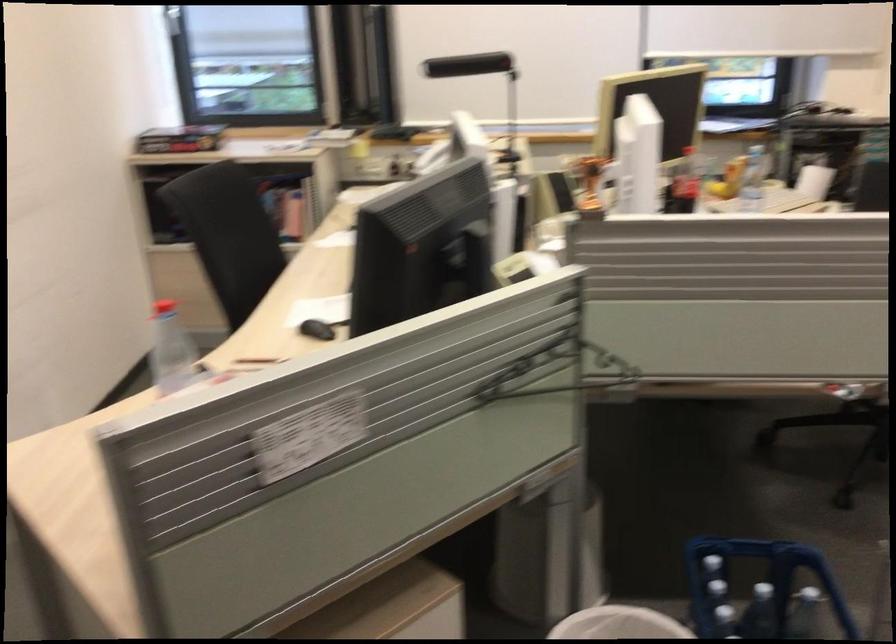
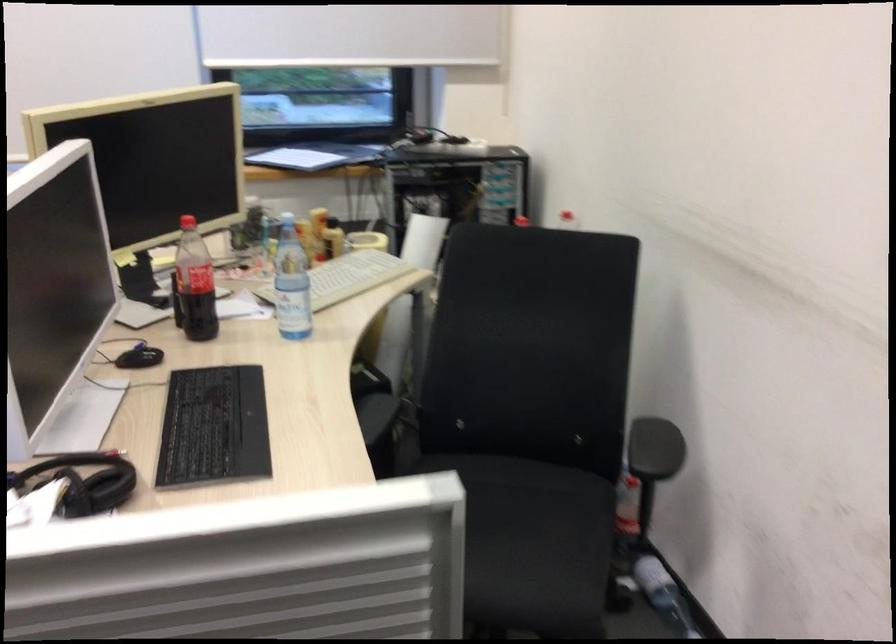
Find the pixel in the second image that matches pixel 767 198 in the first image.

(347, 277)